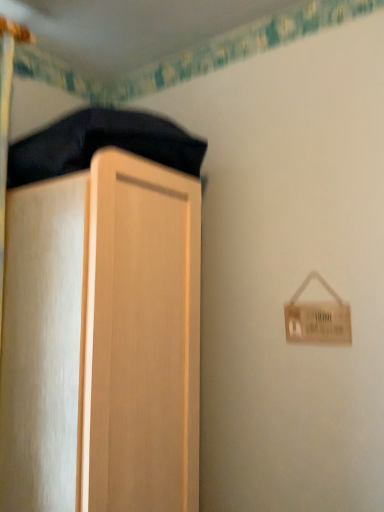
The width and height of the screenshot is (384, 512). I want to click on light wood cupboard at left, so click(102, 341).

Image resolution: width=384 pixels, height=512 pixels. What do you see at coordinates (102, 341) in the screenshot? I see `light wood cupboard at left` at bounding box center [102, 341].

Measure the distance between velvet dark blue blanket at upper left and camera.

A distance of 38.70 inches exists between velvet dark blue blanket at upper left and camera.

What do you see at coordinates (101, 144) in the screenshot?
I see `velvet dark blue blanket at upper left` at bounding box center [101, 144].

Locate an element on the screen. velvet dark blue blanket at upper left is located at coordinates (101, 144).

Where is `light wood cupboard at left`? This screenshot has height=512, width=384. light wood cupboard at left is located at coordinates (102, 341).

Considering the positions of objects light wood cupboard at left and velvet dark blue blanket at upper left in the image provided, who is more to the right, light wood cupboard at left or velvet dark blue blanket at upper left?

Positioned to the right is velvet dark blue blanket at upper left.

Considering the relative positions of light wood cupboard at left and velvet dark blue blanket at upper left in the image provided, is light wood cupboard at left in front of velvet dark blue blanket at upper left?

Yes, it is in front of velvet dark blue blanket at upper left.

Is point (140, 431) closer or farther from the camera than point (88, 159)?

Point (140, 431) is positioned farther from the camera compared to point (88, 159).

From the image's perspective, is light wood cupboard at left under velvet dark blue blanket at upper left?

Yes, from the image's perspective, light wood cupboard at left is beneath velvet dark blue blanket at upper left.

From a real-world perspective, between light wood cupboard at left and velvet dark blue blanket at upper left, who is vertically lower?

light wood cupboard at left is physically lower.

Which object is thinner, light wood cupboard at left or velvet dark blue blanket at upper left?

light wood cupboard at left.

Is light wood cupboard at left taller than velvet dark blue blanket at upper left?

Yes, light wood cupboard at left is taller than velvet dark blue blanket at upper left.

Between light wood cupboard at left and velvet dark blue blanket at upper left, which one has larger size?

With larger size is light wood cupboard at left.

Would you say light wood cupboard at left is outside velvet dark blue blanket at upper left?

Indeed, light wood cupboard at left is completely outside velvet dark blue blanket at upper left.

Is light wood cupboard at left far from velvet dark blue blanket at upper left?

light wood cupboard at left is actually quite close to velvet dark blue blanket at upper left.

Looking at this image, could you tell me if light wood cupboard at left is facing velvet dark blue blanket at upper left?

No, light wood cupboard at left does not turn towards velvet dark blue blanket at upper left.

How different are the orientations of light wood cupboard at left and velvet dark blue blanket at upper left in degrees?

light wood cupboard at left and velvet dark blue blanket at upper left are facing 0.000486 degrees away from each other.

Identify the location of bedding lying behind the light wood cupboard at left. This screenshot has width=384, height=512. [101, 144].

Can you confirm if velvet dark blue blanket at upper left is positioned to the left of light wood cupboard at left?

In fact, velvet dark blue blanket at upper left is to the right of light wood cupboard at left.

Is velvet dark blue blanket at upper left in front of or behind light wood cupboard at left in the image?

In the image, velvet dark blue blanket at upper left appears behind light wood cupboard at left.

Is point (91, 109) less distant than point (105, 330)?

That is False.

From the image's perspective, is velvet dark blue blanket at upper left below light wood cupboard at left?

Incorrect, from the image's perspective, velvet dark blue blanket at upper left is higher than light wood cupboard at left.

From a real-world perspective, is velvet dark blue blanket at upper left positioned above or below light wood cupboard at left?

In terms of real-world spatial position, velvet dark blue blanket at upper left is above light wood cupboard at left.

Considering the sizes of objects velvet dark blue blanket at upper left and light wood cupboard at left in the image provided, who is thinner, velvet dark blue blanket at upper left or light wood cupboard at left?

Thinner between the two is light wood cupboard at left.

Is velvet dark blue blanket at upper left shorter than light wood cupboard at left?

Indeed, velvet dark blue blanket at upper left has a lesser height compared to light wood cupboard at left.

Which of these two, velvet dark blue blanket at upper left or light wood cupboard at left, is bigger?

Bigger between the two is light wood cupboard at left.

Would you say velvet dark blue blanket at upper left contains light wood cupboard at left?

No, light wood cupboard at left is not a part of velvet dark blue blanket at upper left.

Is velvet dark blue blanket at upper left directly adjacent to light wood cupboard at left?

There is a gap between velvet dark blue blanket at upper left and light wood cupboard at left.

Is velvet dark blue blanket at upper left facing away from light wood cupboard at left?

That's not correct — velvet dark blue blanket at upper left is not looking away from light wood cupboard at left.

Identify the location of cupboard that is on the left side of velvet dark blue blanket at upper left. Image resolution: width=384 pixels, height=512 pixels. (102, 341).

Locate an element on the screen. cupboard on the left side of velvet dark blue blanket at upper left is located at coordinates (102, 341).

I want to click on bedding above the light wood cupboard at left (from a real-world perspective), so click(101, 144).